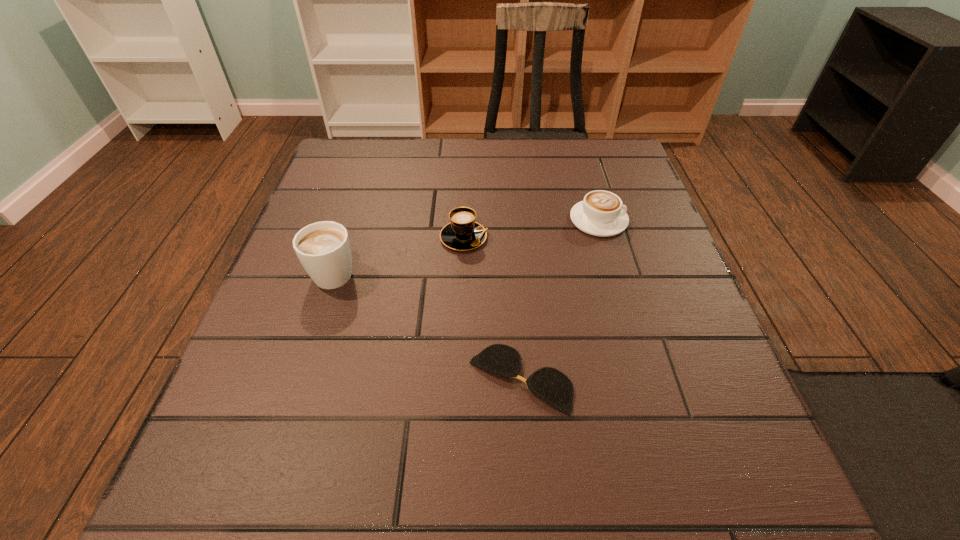
Find the location of `vacant area between the second cappuccino from right to left and the nearest object`. vacant area between the second cappuccino from right to left and the nearest object is located at coordinates (492, 308).

The image size is (960, 540). I want to click on free area in between the rightmost object and the second cappuccino from left to right, so click(531, 228).

Locate an element on the screen. This screenshot has height=540, width=960. vacant area that lies between the tallest cappuccino and the second cappuccino from left to right is located at coordinates (399, 254).

You are a GUI agent. You are given a task and a screenshot of the screen. Output one action in this format:
    pyautogui.click(x=<x>, y=<y>)
    Task: Click on the free space between the spectacles and the rightmost cappuccino
    The image size is (960, 540).
    Given the screenshot: What is the action you would take?
    pyautogui.click(x=560, y=300)

In order to click on vacant space in between the second cappuccino from left to right and the shortest object in this screenshot , I will do `click(492, 308)`.

At what (x,y) coordinates should I click in order to perform the action: click on free space between the rightmost cappuccino and the second cappuccino from right to left. Please return your answer as a coordinate pair (x, y). This screenshot has height=540, width=960. Looking at the image, I should click on (531, 228).

The height and width of the screenshot is (540, 960). In order to click on the second closest object relative to the rightmost cappuccino in this screenshot , I will do `click(551, 385)`.

Identify which object is the second nearest to the rightmost object. Please provide its 2D coordinates. Your answer should be formatted as a tuple, i.e. [(x, y)], where the tuple contains the x and y coordinates of a point satisfying the conditions above.

[(551, 385)]

You are a GUI agent. You are given a task and a screenshot of the screen. Output one action in this format:
    pyautogui.click(x=<x>, y=<y>)
    Task: Click on the cappuccino that is the closest to the rightmost cappuccino
    Image resolution: width=960 pixels, height=540 pixels.
    Given the screenshot: What is the action you would take?
    pyautogui.click(x=463, y=233)

This screenshot has width=960, height=540. I want to click on cappuccino that stands as the closest to the second cappuccino from left to right, so click(x=323, y=248).